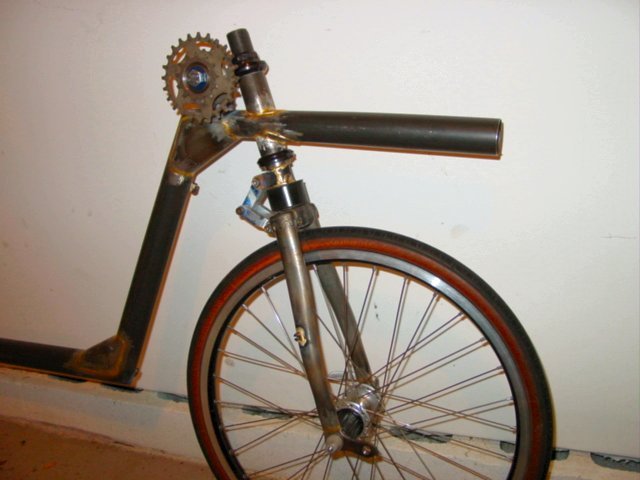
Find the location of a particular element. screws is located at coordinates (342, 446), (371, 450).